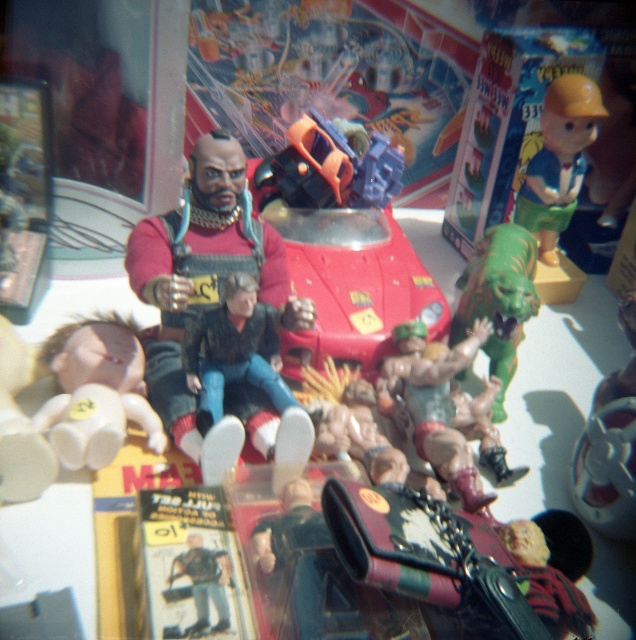
Where is the metallic red car at center located in the image?

The metallic red car at center is located at point (343,243).

You are organizing a toy store shelf and need to stack the matte plastic toy at upper right and the green rubber toy at center vertically. Which toy should go on the bottom to ensure stability?

The green rubber toy at center should go on the bottom because it is taller than the matte plastic toy at upper right, providing a stable base for the stack.

You are a delivery robot with a 10 inch wide package. You need to place it between the matte plastic toy at upper right and the green rubber toy at center. Is there enough space?

The distance between the matte plastic toy at upper right and the green rubber toy at center is 11.18 inches, so yes, the robot can place the 10 inch wide package between them since there is sufficient space.